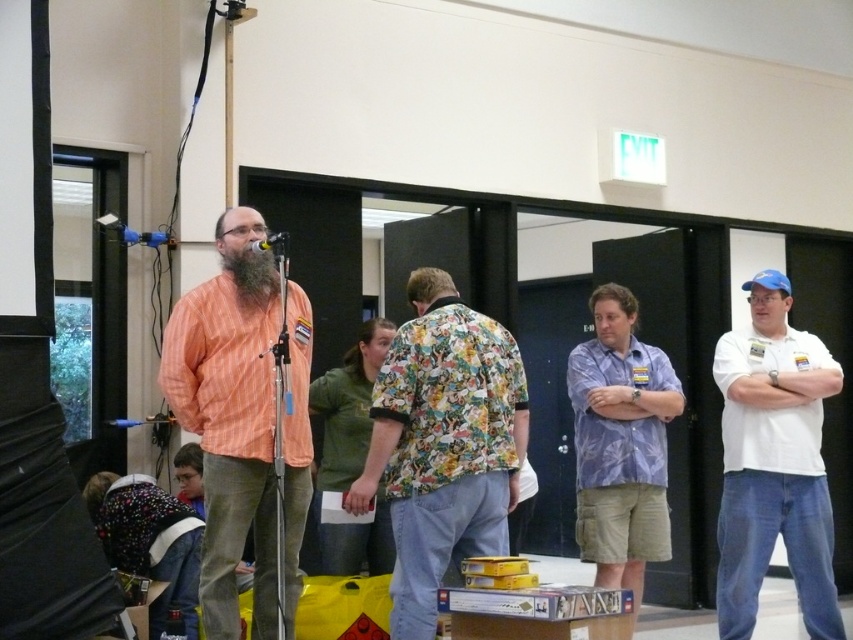
You are standing in the conference room and need to locate the white cotton shirt at right. According to the coordinates provided, where would you find it?

The white cotton shirt at right is located at coordinates point (775, 464).